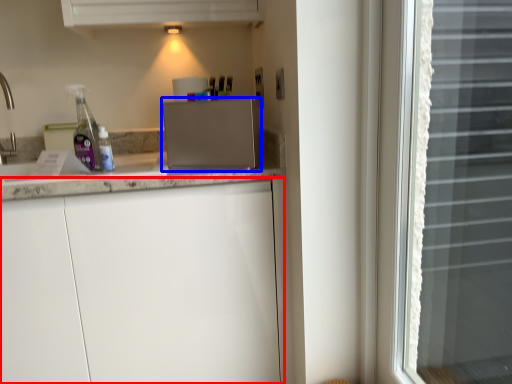
Question: Which point is closer to the camera, cabinetry (highlighted by a red box) or appliance (highlighted by a blue box)?

Choices:
 (A) cabinetry
 (B) appliance

Answer: (A)